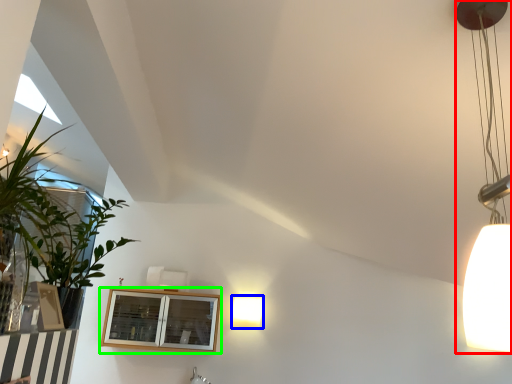
Question: Which object is positioned farthest from lamp (highlighted by a red box)? Select from lamp (highlighted by a blue box) and window (highlighted by a green box).

Choices:
 (A) lamp
 (B) window

Answer: (A)